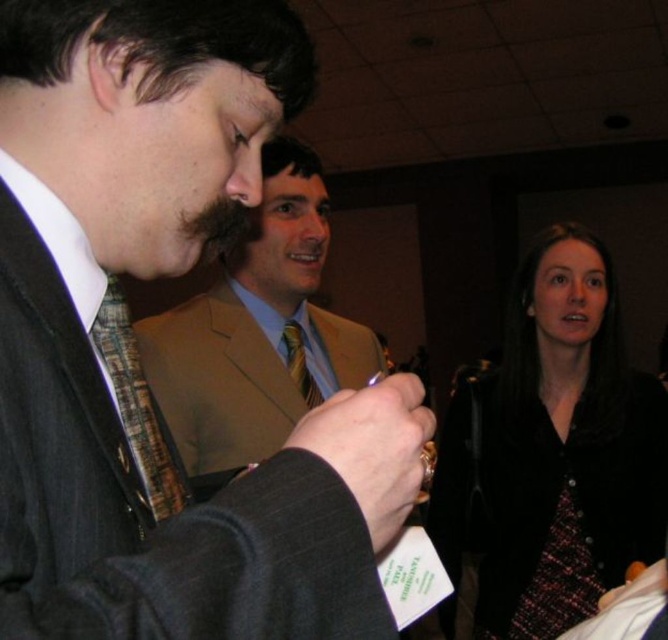
Question: Among these points, which one is nearest to the camera?

Choices:
 (A) (216, 362)
 (B) (369, 417)
 (C) (172, 493)

Answer: (B)

Question: Which object is the closest to the plaid fabric tie at center?

Choices:
 (A) light brown suit at center
 (B) blue striped tie at center
 (C) black velvet jacket at lower right

Answer: (A)

Question: Can you confirm if matte black suit at center is wider than black velvet jacket at lower right?

Choices:
 (A) yes
 (B) no

Answer: (B)

Question: Considering the real-world distances, which object is closest to the black velvet jacket at lower right?

Choices:
 (A) blue striped tie at center
 (B) light brown suit at center

Answer: (B)

Question: Can you confirm if black velvet jacket at lower right is positioned to the left of light brown suit at center?

Choices:
 (A) yes
 (B) no

Answer: (B)

Question: Can you confirm if black velvet jacket at lower right is smaller than plaid fabric tie at center?

Choices:
 (A) no
 (B) yes

Answer: (A)